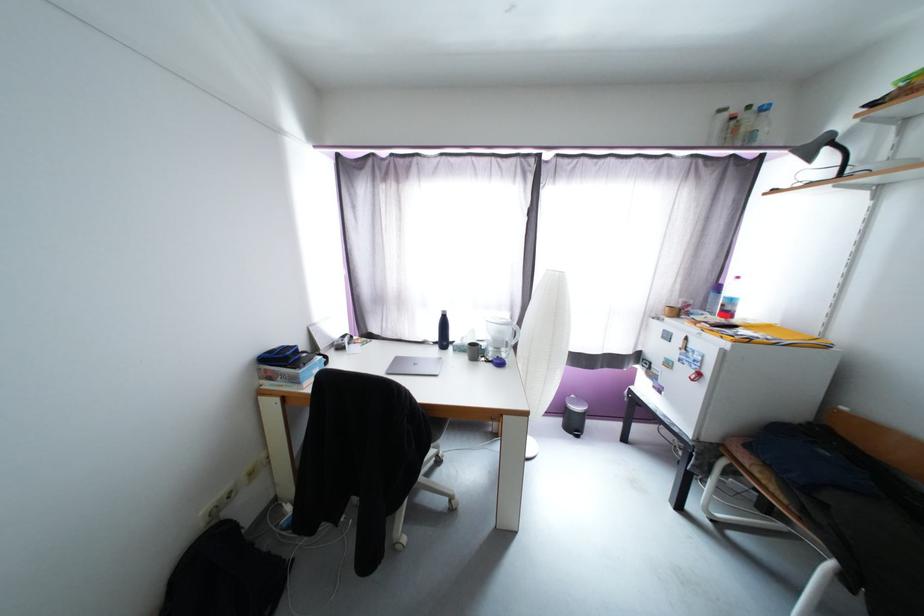
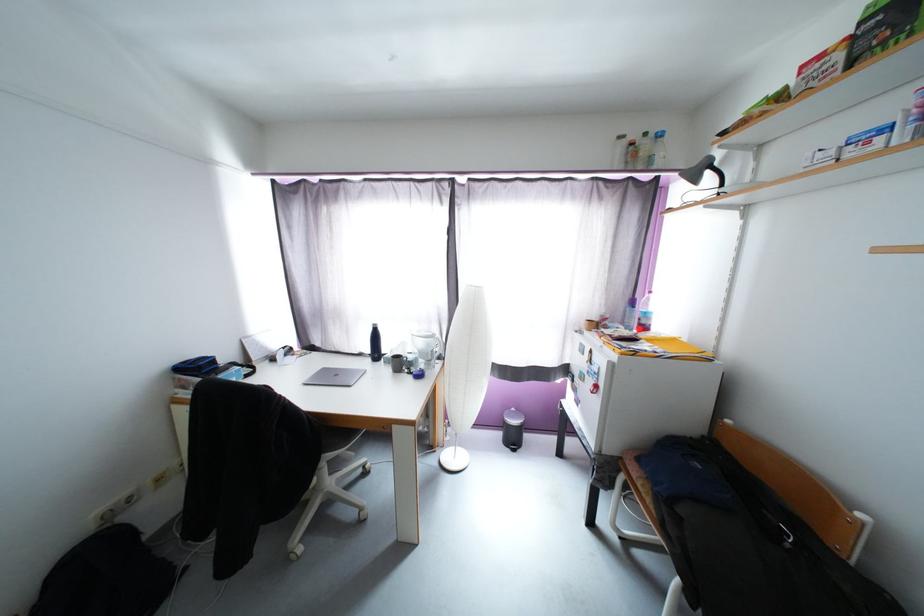
In the second image, find the point that corresponds to [737,302] in the first image.

(651, 315)